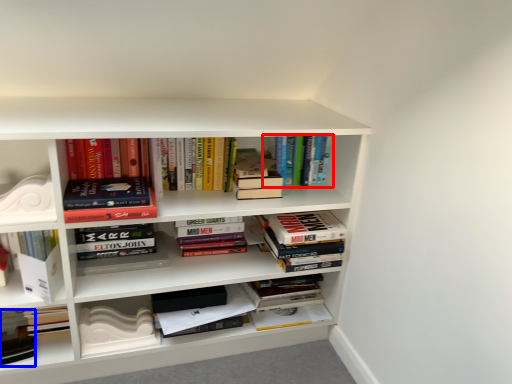
Question: Which point is further to the camera, book (highlighted by a red box) or book (highlighted by a blue box)?

Choices:
 (A) book
 (B) book

Answer: (A)